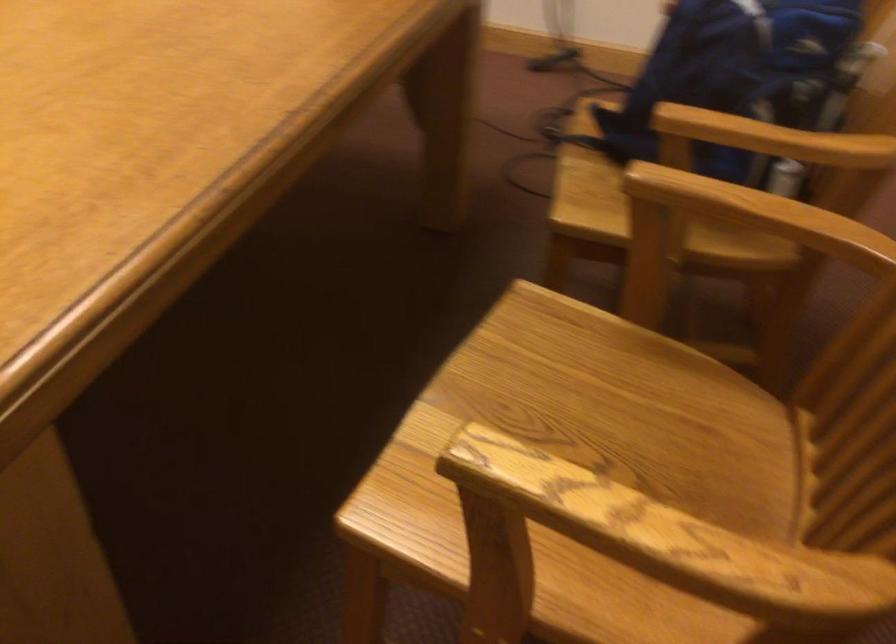
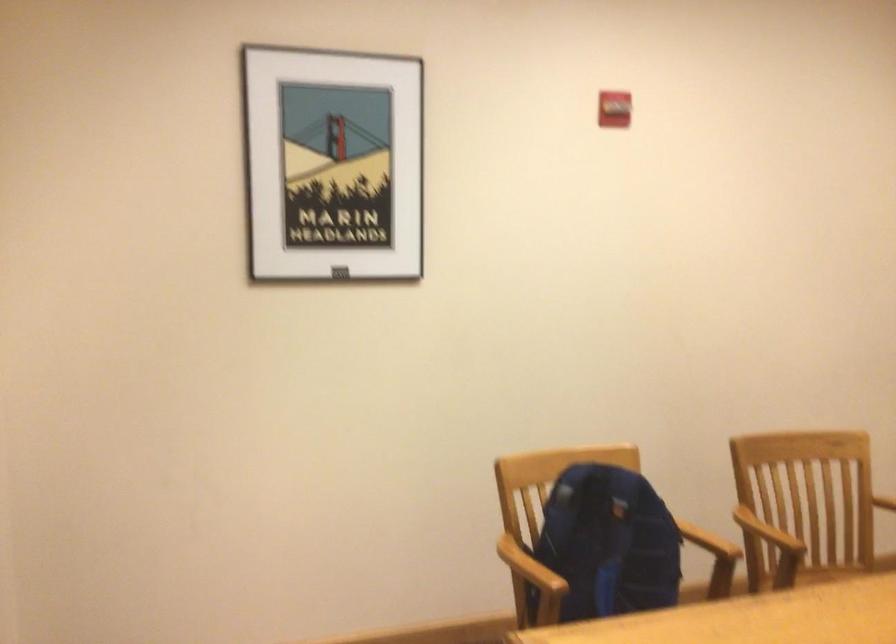
Where in the second image is the point corresponding to [762,540] from the first image?

(837, 572)